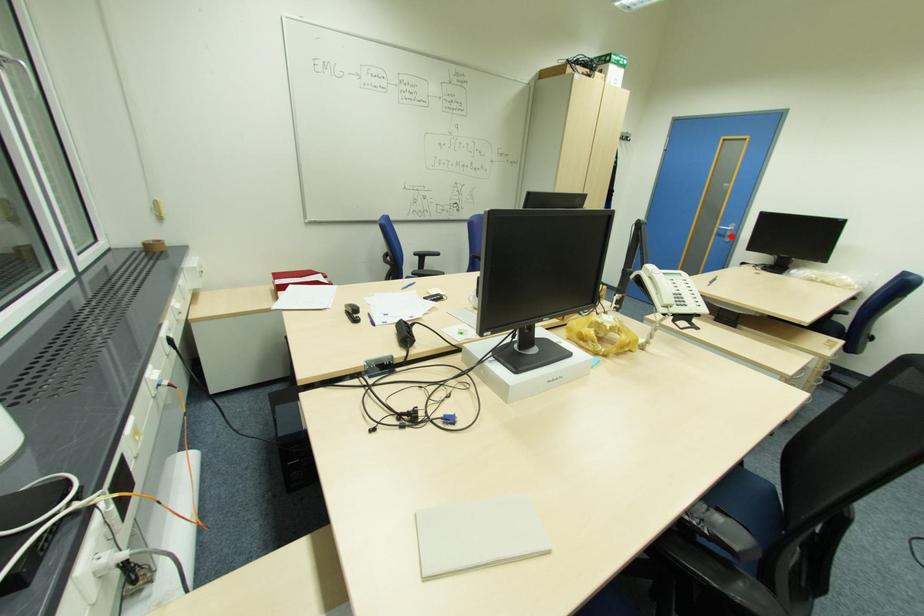
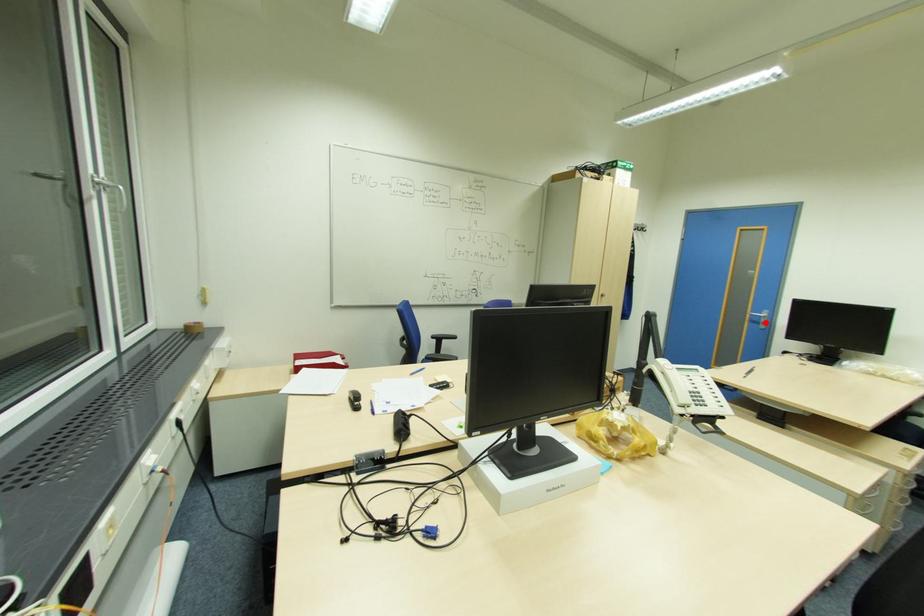
I am providing you with two images of the same scene from different viewpoints. A red point is marked on the first image and another point is marked on the second image. Does the point marked in image1 correspond to the same location as the one in image2?

Yes